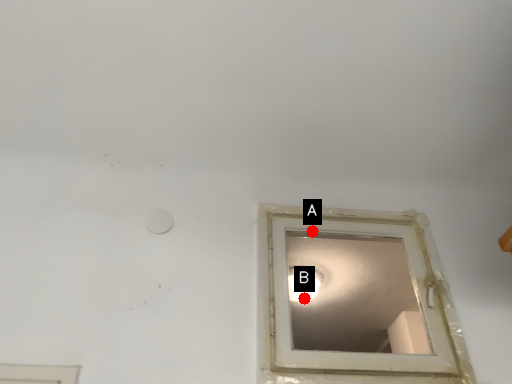
Question: Two points are circled on the image, labeled by A and B beside each circle. Among these points, which one is nearest to the camera?

Choices:
 (A) A is closer
 (B) B is closer

Answer: (A)